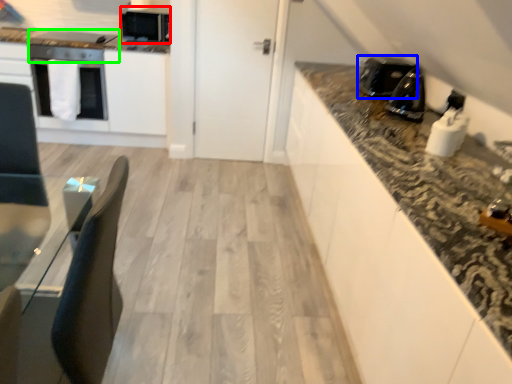
Question: Estimate the real-world distances between objects in this image. Which object is farther from appliance (highlighted by a red box), kitchen appliance (highlighted by a blue box) or appliance (highlighted by a green box)?

Choices:
 (A) kitchen appliance
 (B) appliance

Answer: (A)